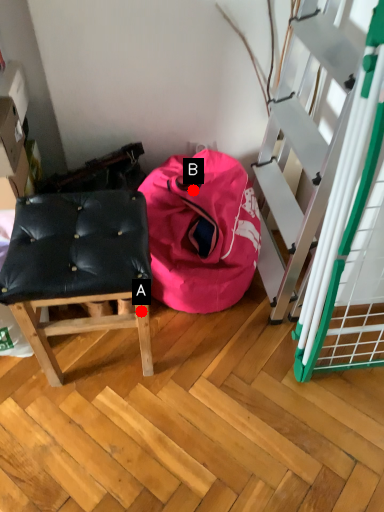
Question: Two points are circled on the image, labeled by A and B beside each circle. Which point is further to the camera?

Choices:
 (A) A is further
 (B) B is further

Answer: (B)